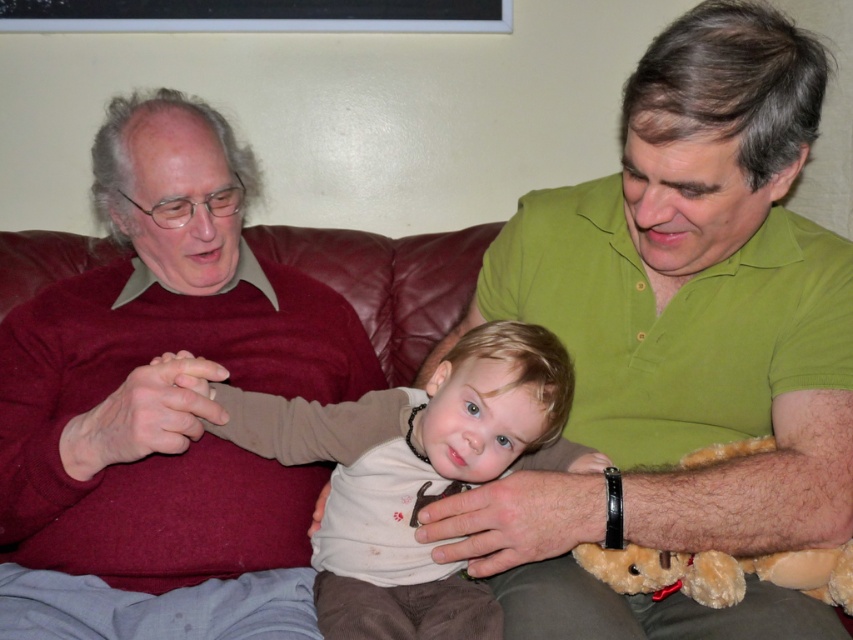
You are a photographer trying to capture a candid shot of the green matte shirt at center and the maroon sweater at left. Based on their positions, which one should you focus on first to ensure both are in frame?

The green matte shirt at center is above the maroon sweater at left, so focusing on the maroon sweater at left first will ensure both are in frame.